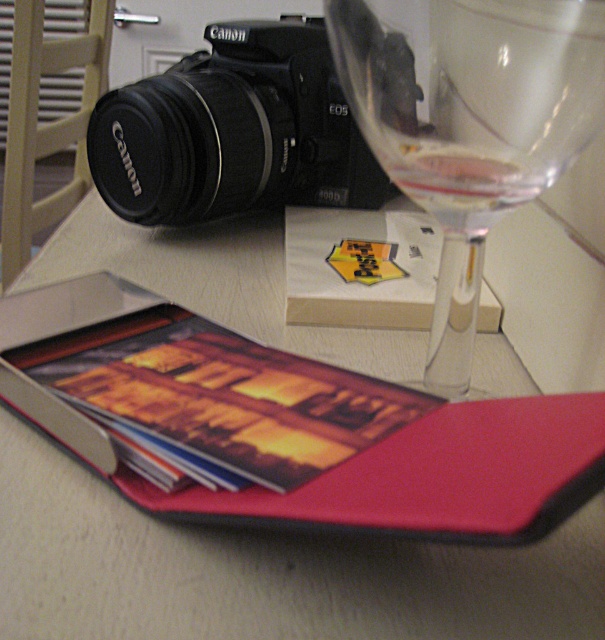
Question: Is transparent glass wine glass at upper right bigger than black matte canon camera at upper left?

Choices:
 (A) no
 (B) yes

Answer: (A)

Question: Is matte plastic tray at upper left to the right of clear glass wine at upper right from the viewer's perspective?

Choices:
 (A) no
 (B) yes

Answer: (A)

Question: Which object appears farthest from the camera in this image?

Choices:
 (A) matte plastic tray at upper left
 (B) clear glass wine at upper right
 (C) black matte canon camera at upper left

Answer: (C)

Question: Which point appears farthest from the camera in this image?

Choices:
 (A) (165, 76)
 (B) (431, 209)

Answer: (A)

Question: Can you confirm if matte plastic tray at upper left is positioned above transparent glass wine glass at upper right?

Choices:
 (A) yes
 (B) no

Answer: (B)

Question: Which of these objects is positioned closest to the clear glass wine at upper right?

Choices:
 (A) black matte canon camera at upper left
 (B) matte plastic tray at upper left
 (C) transparent glass wine glass at upper right

Answer: (C)